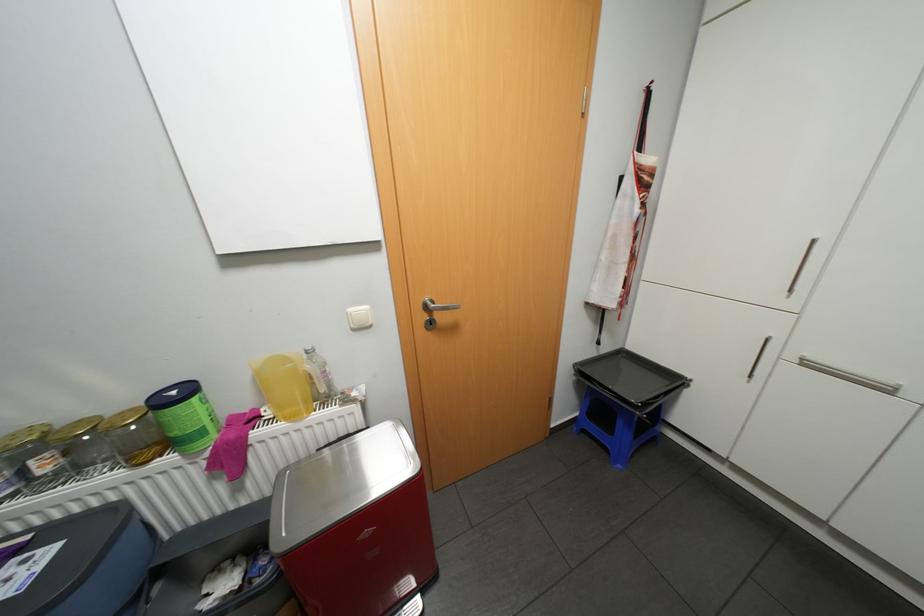
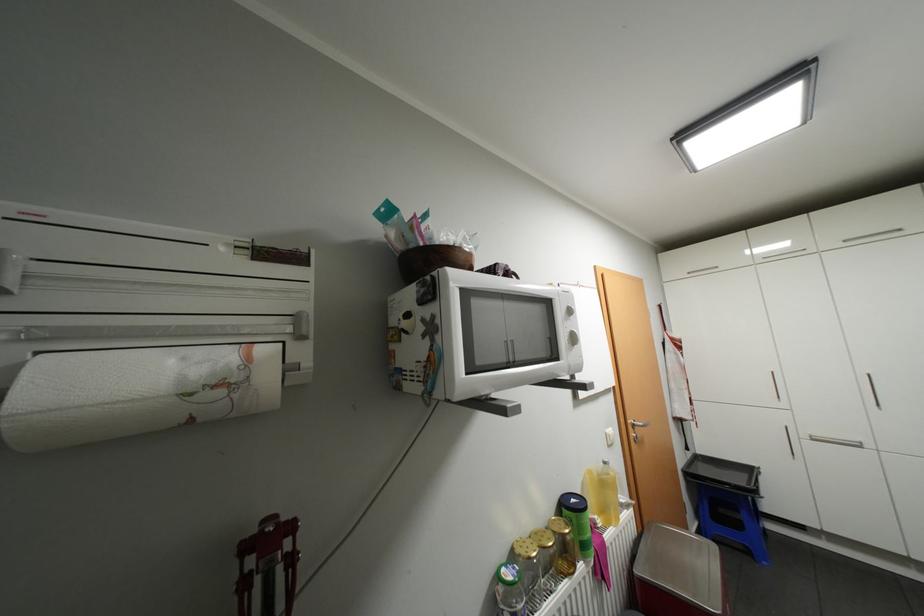
The point at (813, 363) is marked in the first image. Where is the corresponding point in the second image?

(821, 438)